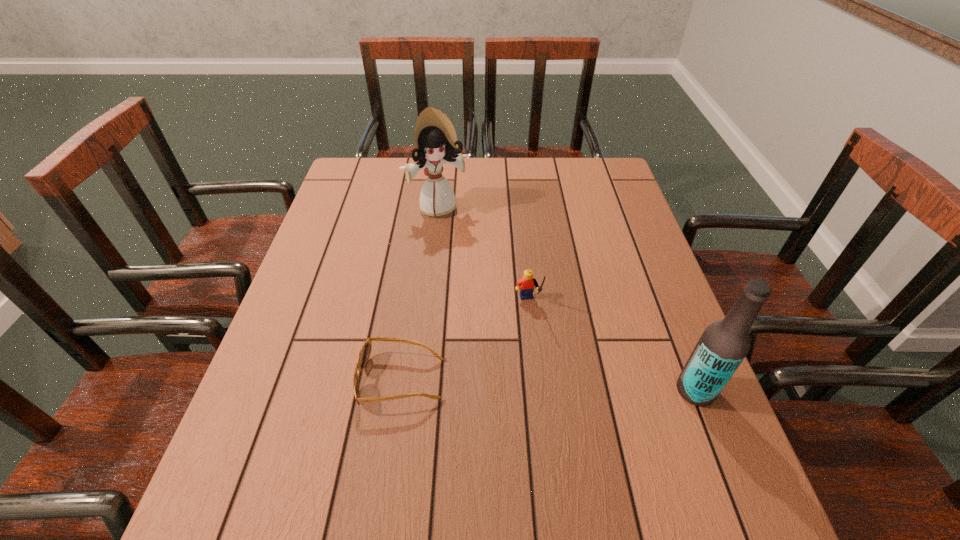
Where is `vacant space located on the side of the beer bottle with the label`? This screenshot has width=960, height=540. vacant space located on the side of the beer bottle with the label is located at coordinates click(554, 390).

The image size is (960, 540). I want to click on vacant point located at the front face of the farthest object, so click(477, 275).

Where is `vacant space located 0.350m at the front face of the farthest object`? This screenshot has height=540, width=960. vacant space located 0.350m at the front face of the farthest object is located at coordinates (492, 305).

Where is `vacant area situated at the front face of the farthest object`? This screenshot has width=960, height=540. vacant area situated at the front face of the farthest object is located at coordinates (492, 305).

The width and height of the screenshot is (960, 540). I want to click on vacant space positioned 0.300m on the front-facing side of the second farthest object, so click(x=563, y=435).

Where is `free space located 0.080m on the front-facing side of the second farthest object`? This screenshot has height=540, width=960. free space located 0.080m on the front-facing side of the second farthest object is located at coordinates (538, 341).

Locate an element on the screen. The image size is (960, 540). blank space located 0.290m on the front-facing side of the second farthest object is located at coordinates (562, 429).

The height and width of the screenshot is (540, 960). I want to click on object that is at the far edge, so click(435, 142).

Find the location of a particular element. The width and height of the screenshot is (960, 540). object that is at the right edge is located at coordinates (724, 344).

Image resolution: width=960 pixels, height=540 pixels. Find the location of `vacant space at the far edge`. vacant space at the far edge is located at coordinates (517, 165).